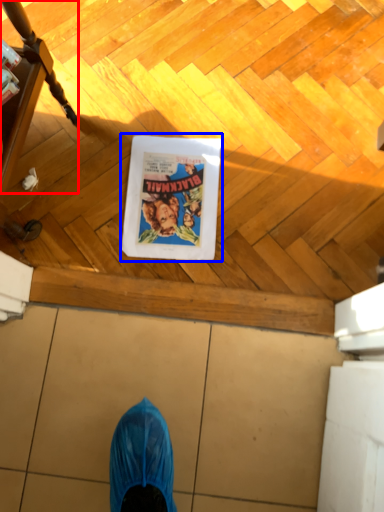
Question: Which object is further to the camera taking this photo, furniture (highlighted by a red box) or comic book character (highlighted by a blue box)?

Choices:
 (A) furniture
 (B) comic book character

Answer: (B)